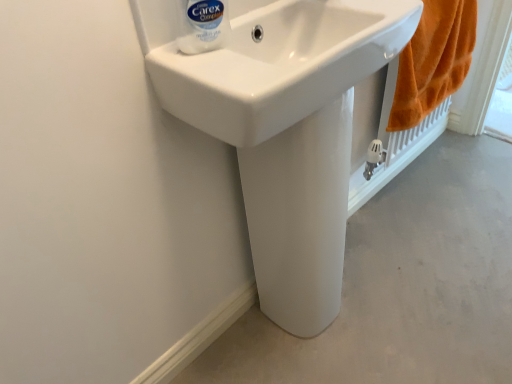
Identify the location of blank area beneath orange fluffy towel at right (from a real-world perspective). (405, 182).